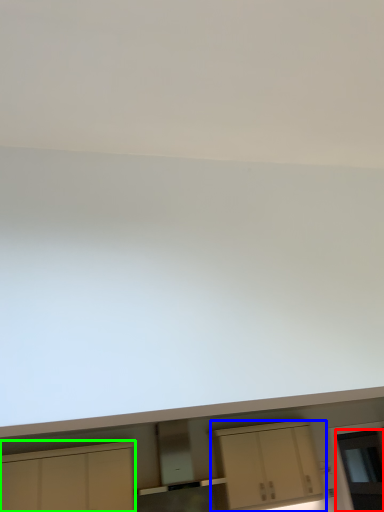
Question: Which is nearer to the glass door (highlighted by a red box)? cabinetry (highlighted by a blue box) or cabinetry (highlighted by a green box).

Choices:
 (A) cabinetry
 (B) cabinetry

Answer: (A)